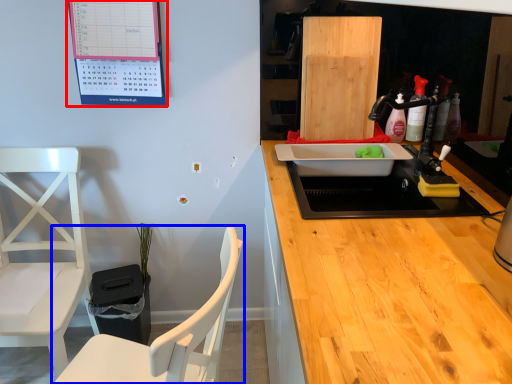
Question: Which of the following is the closest to the observer, bulletin board (highlighted by a red box) or chair (highlighted by a blue box)?

Choices:
 (A) bulletin board
 (B) chair

Answer: (B)